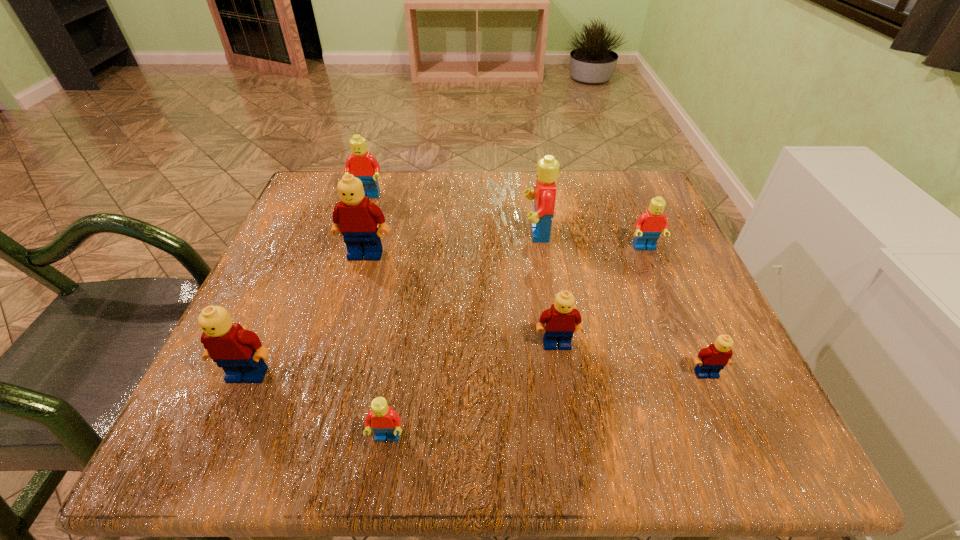
Find the location of a particular element. the smallest yellow Lego is located at coordinates (709, 362).

Locate an element on the screen. The image size is (960, 540). the nearest Lego is located at coordinates (385, 422).

The image size is (960, 540). Find the location of `the nearest object`. the nearest object is located at coordinates (385, 422).

Image resolution: width=960 pixels, height=540 pixels. What are the coordinates of `free region located 0.380m on the face of the biggest red Lego` in the screenshot? It's located at (347, 233).

Image resolution: width=960 pixels, height=540 pixels. I want to click on free space located 0.320m on the face of the biggest red Lego, so click(374, 233).

Where is `free point located 0.270m on the face of the biggest red Lego`? This screenshot has width=960, height=540. free point located 0.270m on the face of the biggest red Lego is located at coordinates (397, 233).

This screenshot has height=540, width=960. What are the coordinates of `vacant point located on the front-facing side of the biggest yellow Lego` in the screenshot? It's located at (319, 419).

Image resolution: width=960 pixels, height=540 pixels. Identify the location of free space located 0.300m on the face of the farthest object. (335, 295).

Locate an element on the screen. free region located on the front-facing side of the leftmost Lego is located at coordinates (228, 421).

I want to click on vacant space located on the face of the rightmost red Lego, so click(707, 400).